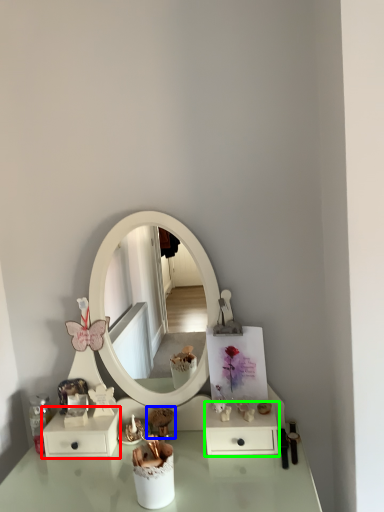
Question: Considering the real-world distances, which object is farthest from dresser (highlighted by a red box)? toy (highlighted by a blue box) or dresser (highlighted by a green box)?

Choices:
 (A) toy
 (B) dresser

Answer: (B)